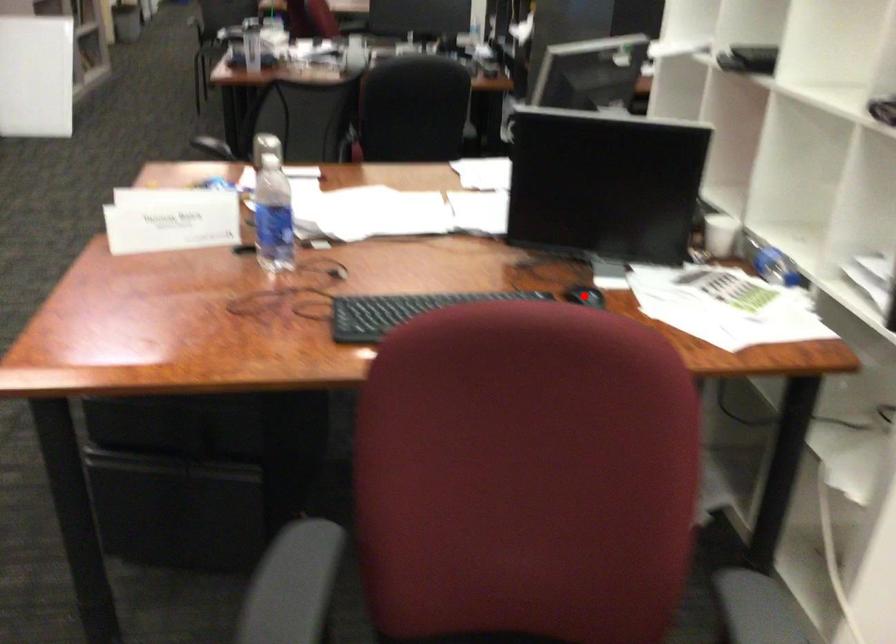
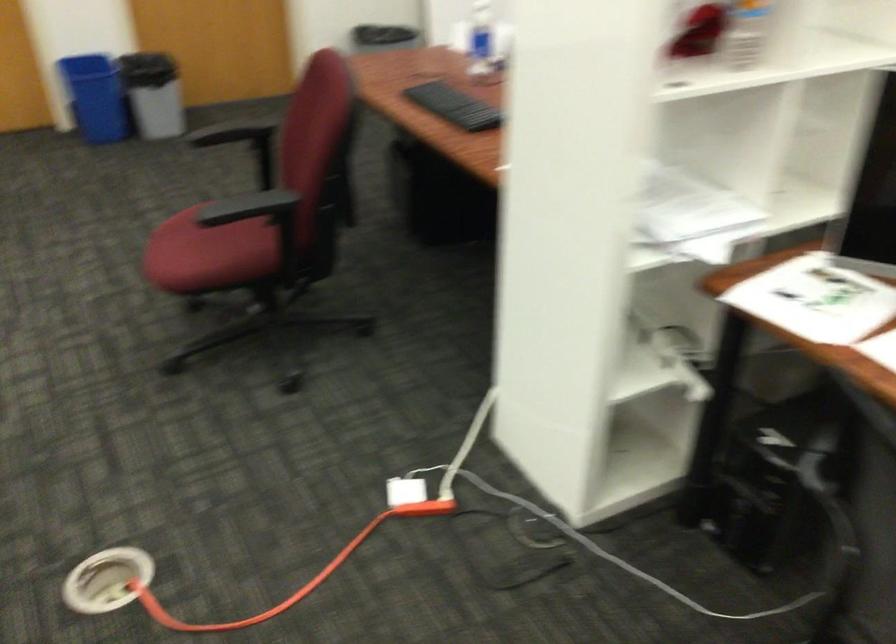
Question: I am providing you with two images of the same scene from different viewpoints. A red point is marked on the first image. Can you still see the location of the red point in image 2?

Choices:
 (A) Yes
 (B) No

Answer: (B)